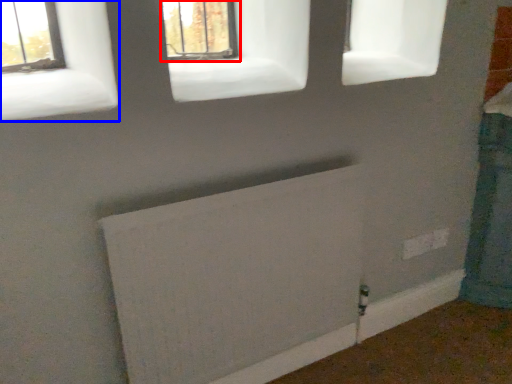
Question: Among these objects, which one is farthest to the camera, window (highlighted by a red box) or window (highlighted by a blue box)?

Choices:
 (A) window
 (B) window

Answer: (A)